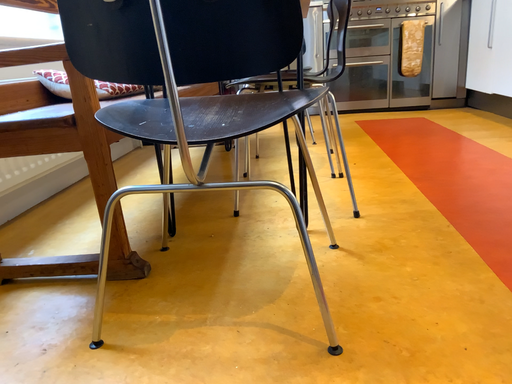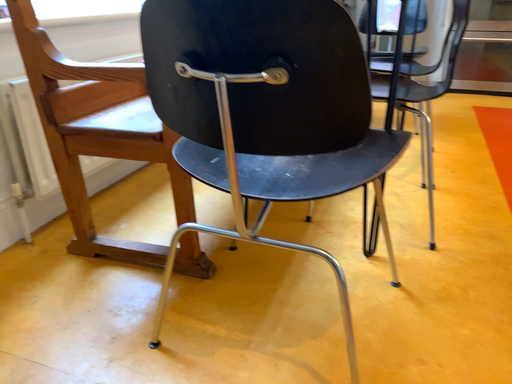
Question: How did the camera likely rotate when shooting the video?

Choices:
 (A) rotated left
 (B) rotated right

Answer: (A)